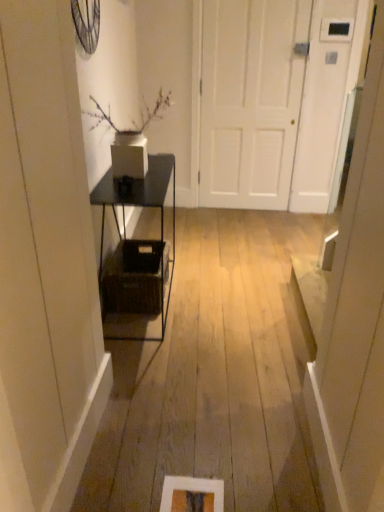
Question: Would you say brown woven basket at center is inside or outside white matte door at center?

Choices:
 (A) outside
 (B) inside

Answer: (A)

Question: Considering the relative positions of brown woven basket at center and white matte door at center in the image provided, is brown woven basket at center to the left or to the right of white matte door at center?

Choices:
 (A) right
 (B) left

Answer: (B)

Question: Estimate the real-world distances between objects in this image. Which object is closer to the white matte door at center?

Choices:
 (A) brown woven basket at center
 (B) black metal shelf at center

Answer: (B)

Question: Which is farther from the black metal shelf at center?

Choices:
 (A) brown woven basket at center
 (B) white matte door at center

Answer: (B)